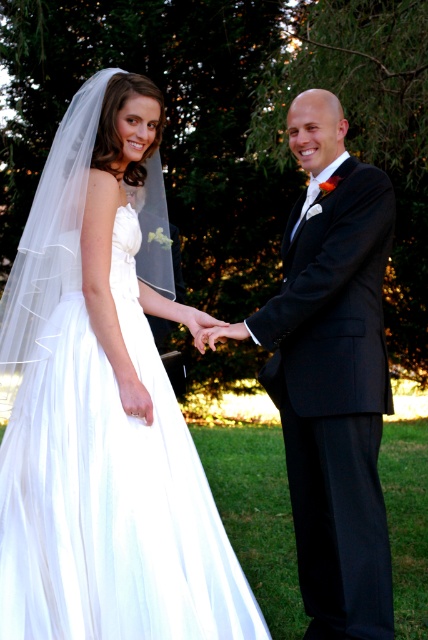
You are a photographer at a wedding and need to adjust the camera focus. The white tulle dress at left and the black satin suit at center are both in your frame. Which one requires a wider aperture setting to ensure proper focus due to its size?

The white tulle dress at left requires a wider aperture setting because it has a larger size compared to the black satin suit at center, which helps in capturing details effectively.

You are a photographer at a wedding. You need to capture a photo of the white tulle dress at left and the black satin suit at center. Based on their positions, which one is closer to the camera?

The white tulle dress at left is positioned over the black satin suit at center, meaning it is closer to the camera.

You are a photographer at the wedding and want to capture a closeup shot of the groom. You are currently positioned at point (32, 352). The groom is standing at point (333, 381). Can you take the photo without moving your position?

Point (32, 352) is in front of point (333, 381), so yes, the photographer can take the photo without moving their position because they are already positioned in front of the groom.